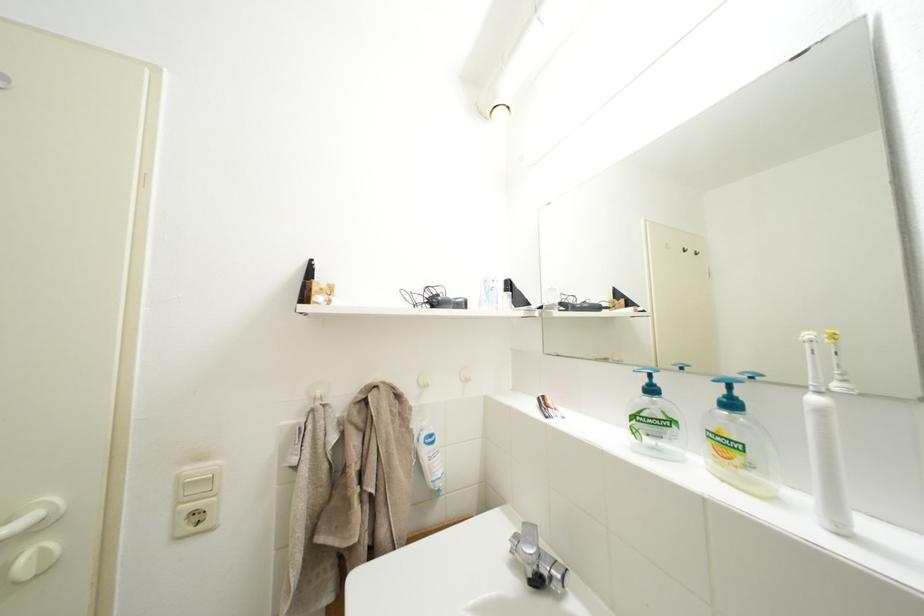
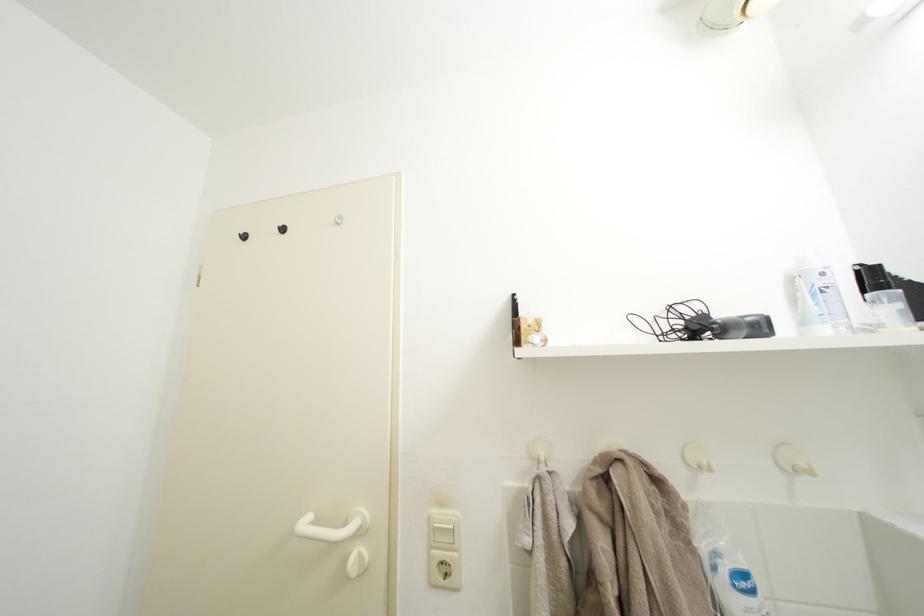
Question: The images are taken continuously from a first-person perspective. In which direction is your viewpoint rotating?

Choices:
 (A) Left
 (B) Right
 (C) Up
 (D) Down

Answer: (A)